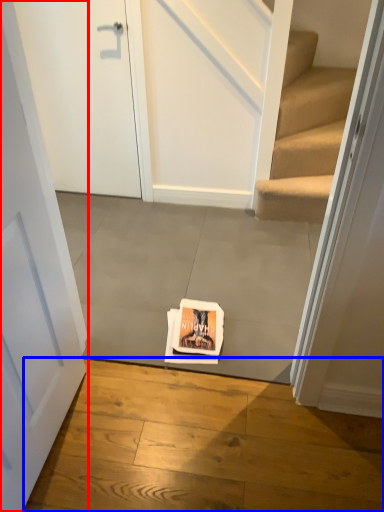
Question: Which object appears closest to the camera in this image, door (highlighted by a red box) or concrete (highlighted by a blue box)?

Choices:
 (A) door
 (B) concrete

Answer: (A)